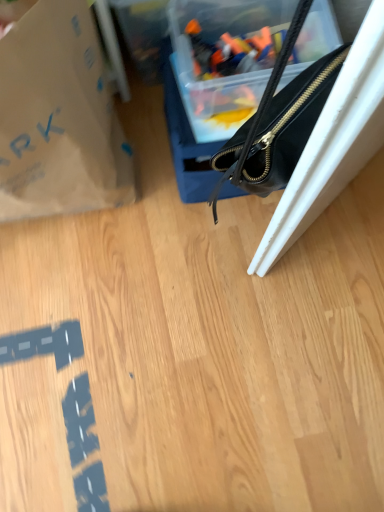
Locate an element on the screen. This screenshot has height=512, width=384. vacant area that is in front of black leather handbag at upper right is located at coordinates (253, 276).